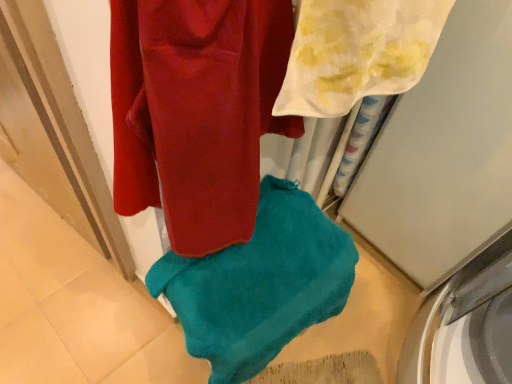
Question: Considering the relative sizes of white glossy washing machine at lower right and teal soft towel at center, which appears as the second towel when viewed from the front, in the image provided, is white glossy washing machine at lower right wider than teal soft towel at center, which appears as the second towel when viewed from the front,?

Choices:
 (A) no
 (B) yes

Answer: (B)

Question: Is the depth of white glossy washing machine at lower right greater than that of teal soft towel at center, placed as the second towel when sorted from top to bottom?

Choices:
 (A) no
 (B) yes

Answer: (B)

Question: From the image's perspective, does white glossy washing machine at lower right appear higher than teal soft towel at center, which appears as the 1th towel when viewed from the back?

Choices:
 (A) yes
 (B) no

Answer: (B)

Question: Does white glossy washing machine at lower right appear on the right side of teal soft towel at center, which ranks as the 1th towel in bottom-to-top order?

Choices:
 (A) no
 (B) yes

Answer: (B)

Question: Could you tell me if white glossy washing machine at lower right is facing teal soft towel at center, which appears as the 1th towel when viewed from the back?

Choices:
 (A) no
 (B) yes

Answer: (A)

Question: In the image, is white sheer towel at upper right, positioned as the 2th towel in bottom-to-top order, positioned in front of or behind white glossy washing machine at lower right?

Choices:
 (A) front
 (B) behind

Answer: (A)

Question: From the image's perspective, is white sheer towel at upper right, marked as the 2th towel in a back-to-front arrangement, located above or below white glossy washing machine at lower right?

Choices:
 (A) below
 (B) above

Answer: (B)

Question: Which is correct: white sheer towel at upper right, positioned as the 2th towel in bottom-to-top order, is inside white glossy washing machine at lower right, or outside of it?

Choices:
 (A) inside
 (B) outside

Answer: (B)

Question: Is white sheer towel at upper right, positioned as the 2th towel in bottom-to-top order, taller or shorter than white glossy washing machine at lower right?

Choices:
 (A) short
 (B) tall

Answer: (B)

Question: In the image, is white sheer towel at upper right, positioned as the 1th towel in top-to-bottom order, positioned in front of or behind teal soft towel at center, which ranks as the 1th towel in bottom-to-top order?

Choices:
 (A) front
 (B) behind

Answer: (A)

Question: From a real-world perspective, is white sheer towel at upper right, placed as the first towel when sorted from front to back, positioned above or below teal soft towel at center, which ranks as the 1th towel in bottom-to-top order?

Choices:
 (A) below
 (B) above

Answer: (B)

Question: In terms of width, does white sheer towel at upper right, positioned as the 2th towel in bottom-to-top order, look wider or thinner when compared to teal soft towel at center, which appears as the second towel when viewed from the front?

Choices:
 (A) wide
 (B) thin

Answer: (B)

Question: Would you say white sheer towel at upper right, placed as the first towel when sorted from front to back, is to the left or to the right of teal soft towel at center, which appears as the second towel when viewed from the front, in the picture?

Choices:
 (A) right
 (B) left

Answer: (A)

Question: Is teal soft towel at center, which appears as the second towel when viewed from the front, in front of or behind white glossy washing machine at lower right in the image?

Choices:
 (A) behind
 (B) front

Answer: (B)

Question: From a real-world perspective, is teal soft towel at center, which appears as the second towel when viewed from the front, positioned above or below white glossy washing machine at lower right?

Choices:
 (A) above
 (B) below

Answer: (A)